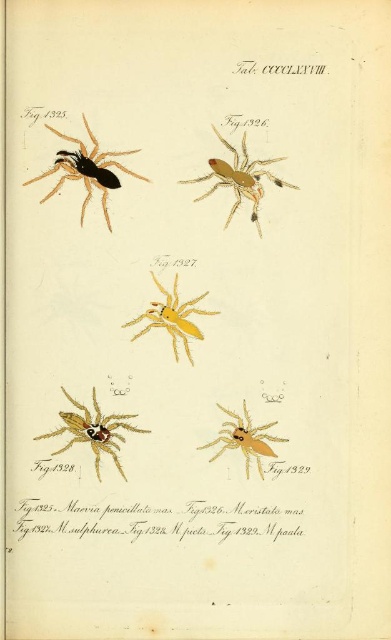
Question: Observing the image, what is the correct spatial positioning of golden metallic spider at lower left in reference to yellow matte spider at center?

Choices:
 (A) left
 (B) right

Answer: (A)

Question: From the image, what is the correct spatial relationship of matte black spider at upper left in relation to matte yellow spider at center?

Choices:
 (A) below
 (B) above

Answer: (B)

Question: Is matte black spider at upper left smaller than matte yellow spider at center?

Choices:
 (A) no
 (B) yes

Answer: (A)

Question: Which point is farther to the camera?

Choices:
 (A) golden metallic spider at lower left
 (B) yellow matte spider at center

Answer: (B)

Question: Which object is the closest to the matte black spider at upper left?

Choices:
 (A) yellow matte spider at center
 (B) golden metallic spider at lower left
 (C) matte yellow spider at center
 (D) golden metallic spider at center

Answer: (C)

Question: Which point is closer to the camera?

Choices:
 (A) (168, 300)
 (B) (229, 436)
 (C) (105, 429)

Answer: (C)